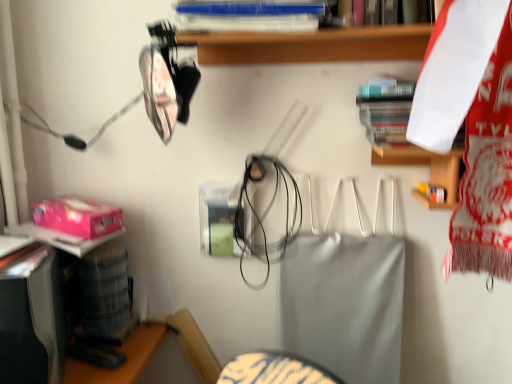
The width and height of the screenshot is (512, 384). Describe the element at coordinates (248, 16) in the screenshot. I see `blue plastic book at upper center, positioned as the first book in top-to-bottom order` at that location.

Identify the location of hardcover book at upper right, which is the 2th book from top to bottom. (385, 110).

Looking at this image, is pink matte box at lower left further to the viewer compared to blue plastic book at upper center, the 2th book viewed from the right?

Yes, it is.

Looking at this image, between pink matte box at lower left and blue plastic book at upper center, positioned as the first book in top-to-bottom order, which one appears on the right side from the viewer's perspective?

blue plastic book at upper center, positioned as the first book in top-to-bottom order.

From the image's perspective, is pink matte box at lower left located above blue plastic book at upper center, the 1th book when ordered from left to right?

Incorrect, from the image's perspective, pink matte box at lower left is lower than blue plastic book at upper center, the 1th book when ordered from left to right.

Measure the distance between pink matte box at lower left and blue plastic book at upper center, the 1th book when ordered from left to right.

23.85 inches.

Who is taller, white plastic shelf at upper center or hardcover book at upper right, which is the 2th book from top to bottom?

Standing taller between the two is white plastic shelf at upper center.

Would you say white plastic shelf at upper center is to the left or to the right of hardcover book at upper right, which appears as the 2th book when viewed from the left, in the picture?

From the image, it's evident that white plastic shelf at upper center is to the left of hardcover book at upper right, which appears as the 2th book when viewed from the left.

How different are the orientations of white plastic shelf at upper center and hardcover book at upper right, arranged as the 1th book when viewed from the right, in degrees?

The angle between the facing direction of white plastic shelf at upper center and the facing direction of hardcover book at upper right, arranged as the 1th book when viewed from the right, is 0.706 degrees.

Identify the location of book below the white plastic shelf at upper center (from the image's perspective). The image size is (512, 384). tap(385, 110).

From a real-world perspective, between hardcover book at upper right, which appears as the 2th book when viewed from the left, and blue plastic book at upper center, which is the second book in bottom-to-top order, who is vertically lower?

hardcover book at upper right, which appears as the 2th book when viewed from the left, from a real-world perspective.

How far apart are hardcover book at upper right, arranged as the 1th book when viewed from the right, and blue plastic book at upper center, the 2th book viewed from the right?

12.04 inches.

Can you confirm if hardcover book at upper right, which ranks as the 1th book in bottom-to-top order, is positioned to the left of blue plastic book at upper center, positioned as the first book in top-to-bottom order?

In fact, hardcover book at upper right, which ranks as the 1th book in bottom-to-top order, is to the right of blue plastic book at upper center, positioned as the first book in top-to-bottom order.

Which object is more forward, hardcover book at upper right, which is the 2th book from top to bottom, or blue plastic book at upper center, which is the second book in bottom-to-top order?

blue plastic book at upper center, which is the second book in bottom-to-top order, is more forward.

Does hardcover book at upper right, which is the 2th book from top to bottom, have a larger size compared to pink matte box at lower left?

Indeed, hardcover book at upper right, which is the 2th book from top to bottom, has a larger size compared to pink matte box at lower left.

Could you tell me if hardcover book at upper right, which is the 2th book from top to bottom, is turned towards pink matte box at lower left?

No, hardcover book at upper right, which is the 2th book from top to bottom, is not aimed at pink matte box at lower left.

Is point (392, 140) in front of point (61, 225)?

Yes, point (392, 140) is in front of point (61, 225).

Considering the sizes of objects hardcover book at upper right, which ranks as the 1th book in bottom-to-top order, and pink matte box at lower left in the image provided, who is thinner, hardcover book at upper right, which ranks as the 1th book in bottom-to-top order, or pink matte box at lower left?

hardcover book at upper right, which ranks as the 1th book in bottom-to-top order, is thinner.

Considering the relative positions of white plastic shelf at upper center and blue plastic book at upper center, positioned as the first book in top-to-bottom order, in the image provided, is white plastic shelf at upper center to the left or to the right of blue plastic book at upper center, positioned as the first book in top-to-bottom order,?

In the image, white plastic shelf at upper center appears on the right side of blue plastic book at upper center, positioned as the first book in top-to-bottom order.

Considering the relative sizes of white plastic shelf at upper center and blue plastic book at upper center, positioned as the first book in top-to-bottom order, in the image provided, is white plastic shelf at upper center shorter than blue plastic book at upper center, positioned as the first book in top-to-bottom order,?

No.

From a real-world perspective, is white plastic shelf at upper center below blue plastic book at upper center, the 1th book when ordered from left to right?

Indeed, from a real-world perspective, white plastic shelf at upper center is positioned beneath blue plastic book at upper center, the 1th book when ordered from left to right.

From the image's perspective, which is below, white plastic shelf at upper center or blue plastic book at upper center, the 2th book viewed from the right?

From the image's view, white plastic shelf at upper center is below.

Is pink matte box at lower left oriented towards white plastic shelf at upper center?

No, pink matte box at lower left is not aimed at white plastic shelf at upper center.

Considering the relative sizes of pink matte box at lower left and white plastic shelf at upper center in the image provided, is pink matte box at lower left taller than white plastic shelf at upper center?

In fact, pink matte box at lower left may be shorter than white plastic shelf at upper center.

Is pink matte box at lower left inside the boundaries of white plastic shelf at upper center, or outside?

pink matte box at lower left is spatially situated outside white plastic shelf at upper center.

From a real-world perspective, is pink matte box at lower left under white plastic shelf at upper center?

Yes, from a real-world perspective, pink matte box at lower left is beneath white plastic shelf at upper center.

In the scene shown: Considering the relative sizes of white plastic shelf at upper center and pink matte box at lower left in the image provided, is white plastic shelf at upper center smaller than pink matte box at lower left?

Actually, white plastic shelf at upper center might be larger than pink matte box at lower left.

From the picture: Which of these two, white plastic shelf at upper center or pink matte box at lower left, is thinner?

white plastic shelf at upper center.

How different are the orientations of white plastic shelf at upper center and pink matte box at lower left in degrees?

They differ by 69.9 degrees in their facing directions.

Measure the distance from white plastic shelf at upper center to pink matte box at lower left.

They are 63.16 centimeters apart.

Where is `box located on the left of blue plastic book at upper center, the 1th book when ordered from left to right`? The height and width of the screenshot is (384, 512). box located on the left of blue plastic book at upper center, the 1th book when ordered from left to right is located at coordinates (77, 216).

Locate an element on the screen. Image resolution: width=512 pixels, height=384 pixels. the 2nd book behind the white plastic shelf at upper center is located at coordinates (385, 110).

Which object lies nearer to the anchor point white plastic shelf at upper center, hardcover book at upper right, arranged as the 1th book when viewed from the right, or blue plastic book at upper center, the 2th book viewed from the right?

blue plastic book at upper center, the 2th book viewed from the right, is positioned closer to the anchor white plastic shelf at upper center.

Based on their spatial positions, is hardcover book at upper right, arranged as the 1th book when viewed from the right, or pink matte box at lower left closer to blue plastic book at upper center, the 1th book when ordered from left to right?

The object closer to blue plastic book at upper center, the 1th book when ordered from left to right, is hardcover book at upper right, arranged as the 1th book when viewed from the right.

Considering their positions, is pink matte box at lower left positioned further to hardcover book at upper right, which appears as the 2th book when viewed from the left, than blue plastic book at upper center, positioned as the first book in top-to-bottom order?

pink matte box at lower left.

Estimate the real-world distances between objects in this image. Which object is further from pink matte box at lower left, blue plastic book at upper center, the 2th book viewed from the right, or hardcover book at upper right, which ranks as the 1th book in bottom-to-top order?

hardcover book at upper right, which ranks as the 1th book in bottom-to-top order, lies further to pink matte box at lower left than the other object.

Which object lies nearer to the anchor point white plastic shelf at upper center, pink matte box at lower left or blue plastic book at upper center, the 2th book viewed from the right?

blue plastic book at upper center, the 2th book viewed from the right, is closer to white plastic shelf at upper center.

Estimate the real-world distances between objects in this image. Which object is further from blue plastic book at upper center, the 1th book when ordered from left to right, pink matte box at lower left or hardcover book at upper right, which ranks as the 1th book in bottom-to-top order?

pink matte box at lower left.

Which object lies further to the anchor point white plastic shelf at upper center, pink matte box at lower left or hardcover book at upper right, which is the 2th book from top to bottom?

The object further to white plastic shelf at upper center is pink matte box at lower left.

Estimate the real-world distances between objects in this image. Which object is closer to white plastic shelf at upper center, blue plastic book at upper center, the 2th book viewed from the right, or pink matte box at lower left?

blue plastic book at upper center, the 2th book viewed from the right, lies closer to white plastic shelf at upper center than the other object.

Identify the location of book between pink matte box at lower left and white plastic shelf at upper center from left to right. This screenshot has height=384, width=512. (248, 16).

You are a GUI agent. You are given a task and a screenshot of the screen. Output one action in this format:
    pyautogui.click(x=<x>, y=<y>)
    Task: Click on the shelf between pink matte box at lower left and hardcover book at upper right, which is the 2th book from top to bottom
    
    Given the screenshot: What is the action you would take?
    pyautogui.click(x=311, y=45)

The height and width of the screenshot is (384, 512). What are the coordinates of `book between pink matte box at lower left and hardcover book at upper right, which ranks as the 1th book in bottom-to-top order, from left to right` in the screenshot? It's located at (248, 16).

In order to click on shelf between blue plastic book at upper center, the 1th book when ordered from left to right, and hardcover book at upper right, arranged as the 1th book when viewed from the right, in the horizontal direction in this screenshot , I will do `click(311, 45)`.